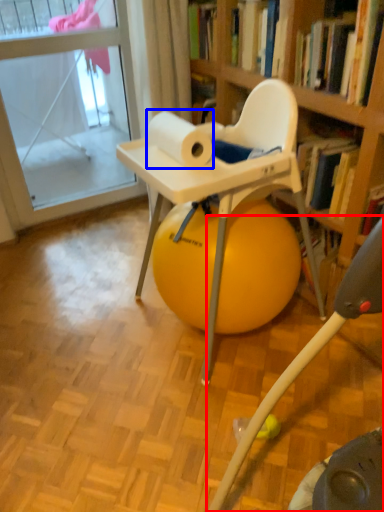
Question: Among these objects, which one is nearest to the camera, feeding chair (highlighted by a red box) or paper towel (highlighted by a blue box)?

Choices:
 (A) feeding chair
 (B) paper towel

Answer: (A)